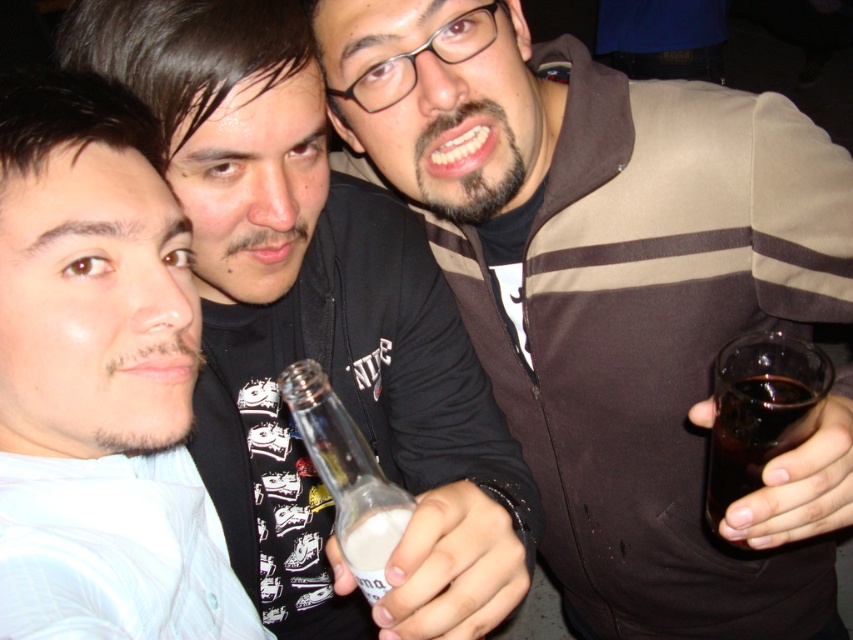
Is clear glass bottle at center shorter than dark glass at right?

In fact, clear glass bottle at center may be taller than dark glass at right.

Looking at this image, between clear glass bottle at center and dark glass at right, which one appears on the left side from the viewer's perspective?

From the viewer's perspective, clear glass bottle at center appears more on the left side.

Which is in front, point (361, 474) or point (737, 369)?

Point (737, 369)

Image resolution: width=853 pixels, height=640 pixels. I want to click on clear glass bottle at center, so click(x=347, y=476).

Who is more distant from viewer, (543,333) or (370,580)?

The point (543,333) is more distant.

Does point (624, 480) come closer to viewer compared to point (315, 416)?

No, (624, 480) is behind (315, 416).

Is point (663, 257) positioned before point (347, 413)?

Yes, point (663, 257) is in front of point (347, 413).

At what (x,y) coordinates should I click in order to perform the action: click on brown fabric jacket at upper right. Please return your answer as a coordinate pair (x, y). Image resolution: width=853 pixels, height=640 pixels. Looking at the image, I should click on (618, 296).

Who is taller, brown fabric jacket at upper right or white matte shirt at left?

brown fabric jacket at upper right is taller.

The height and width of the screenshot is (640, 853). Find the location of `brown fabric jacket at upper right`. brown fabric jacket at upper right is located at coordinates (618, 296).